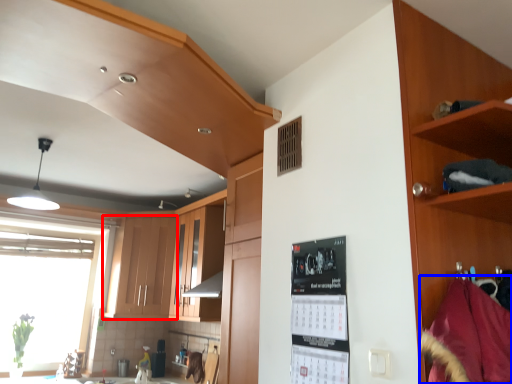
Question: Which point is further to the camera, cabinetry (highlighted by a red box) or material (highlighted by a blue box)?

Choices:
 (A) cabinetry
 (B) material

Answer: (A)